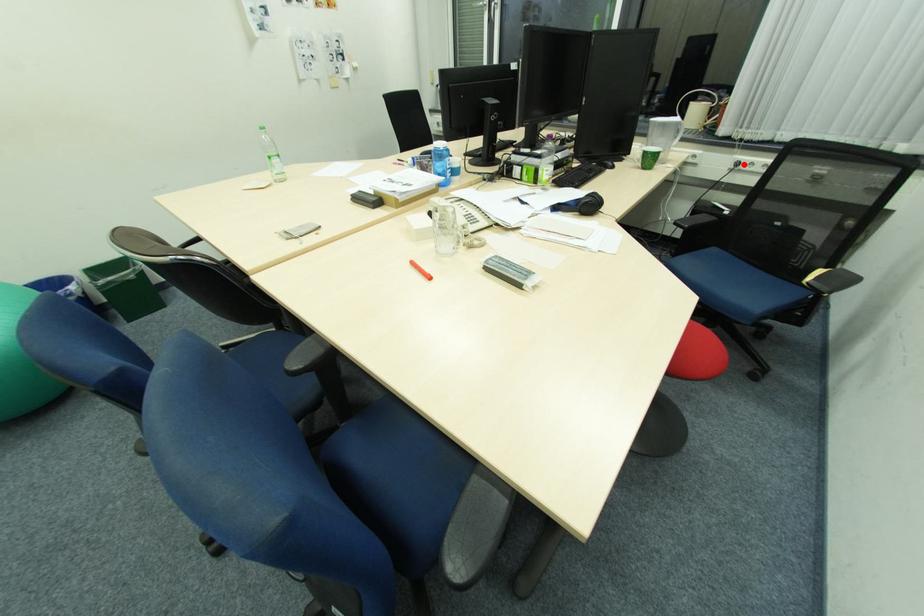
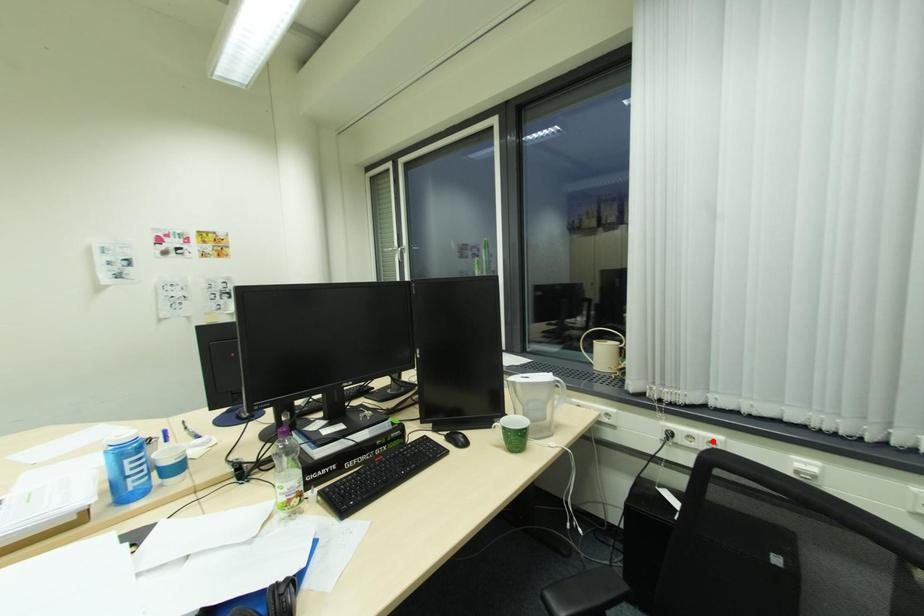
I am providing you with two images of the same scene from different viewpoints. A red point is marked on the first image and another point is marked on the second image. Is the red point in image1 aligned with the point shown in image2?

No